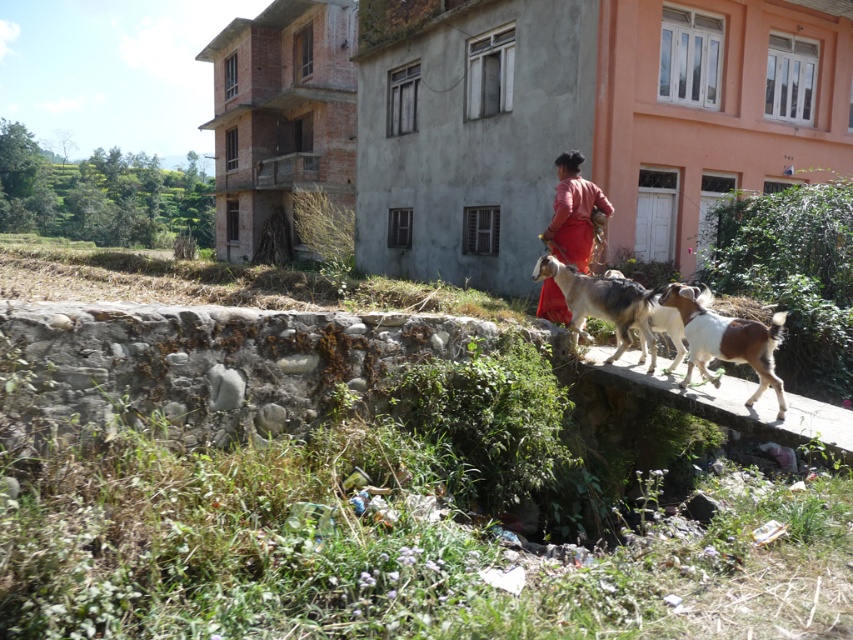
Does white and brown fur at center appear on the right side of matte red dress at center?

Indeed, white and brown fur at center is positioned on the right side of matte red dress at center.

Measure the distance from white and brown fur at center to matte red dress at center.

white and brown fur at center and matte red dress at center are 1.84 meters apart.

Does point (714, 328) lie behind point (558, 230)?

No, it is in front of (558, 230).

The height and width of the screenshot is (640, 853). I want to click on white and brown fur at center, so click(726, 339).

Does white and brown fur at center have a lesser height compared to brown and white fur at center?

Yes, white and brown fur at center is shorter than brown and white fur at center.

Is white and brown fur at center behind brown and white fur at center?

No, it is not.

The width and height of the screenshot is (853, 640). What do you see at coordinates (726, 339) in the screenshot?
I see `white and brown fur at center` at bounding box center [726, 339].

You are a GUI agent. You are given a task and a screenshot of the screen. Output one action in this format:
    pyautogui.click(x=<x>, y=<y>)
    Task: Click on the white and brown fur at center
    
    Given the screenshot: What is the action you would take?
    pyautogui.click(x=726, y=339)

Describe the element at coordinates (728, 403) in the screenshot. I see `brown stone ledge at center` at that location.

Does brown stone ledge at center lie in front of matte red dress at center?

Yes.

This screenshot has width=853, height=640. What do you see at coordinates (728, 403) in the screenshot?
I see `brown stone ledge at center` at bounding box center [728, 403].

Find the location of a particular element. brown stone ledge at center is located at coordinates (728, 403).